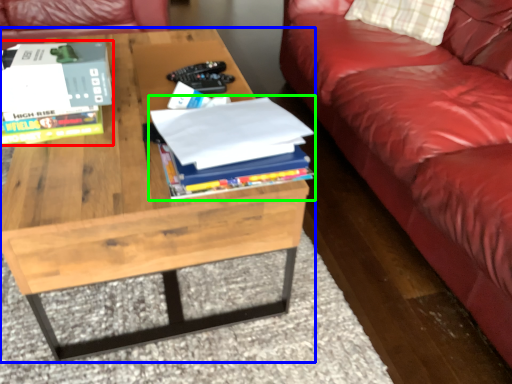
Question: Estimate the real-world distances between objects in this image. Which object is closer to book (highlighted by a red box), coffee table (highlighted by a blue box) or book (highlighted by a green box)?

Choices:
 (A) coffee table
 (B) book

Answer: (A)